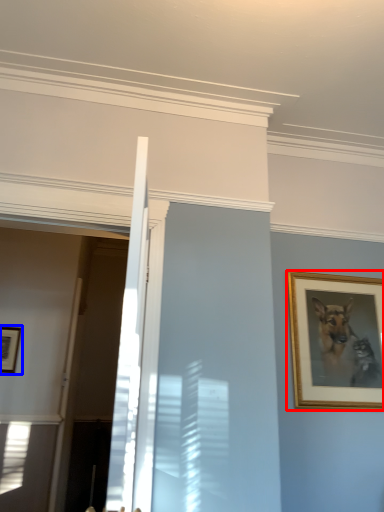
Question: Which point is closer to the camera, picture frame (highlighted by a red box) or picture frame (highlighted by a blue box)?

Choices:
 (A) picture frame
 (B) picture frame

Answer: (A)